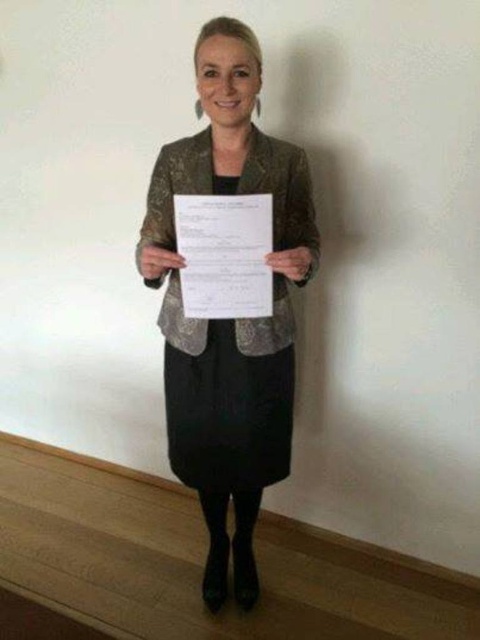
Question: Which point appears farthest from the camera in this image?

Choices:
 (A) (155, 266)
 (B) (183, 300)

Answer: (B)

Question: Does metallic gold blazer at center appear on the right side of white paper at center?

Choices:
 (A) no
 (B) yes

Answer: (B)

Question: Does metallic gold blazer at center have a larger size compared to white paper at center?

Choices:
 (A) no
 (B) yes

Answer: (B)

Question: Which object appears farthest from the camera in this image?

Choices:
 (A) white paper at center
 (B) metallic gold blazer at center

Answer: (B)

Question: Can you confirm if metallic gold blazer at center is positioned below white paper at center?

Choices:
 (A) no
 (B) yes

Answer: (B)